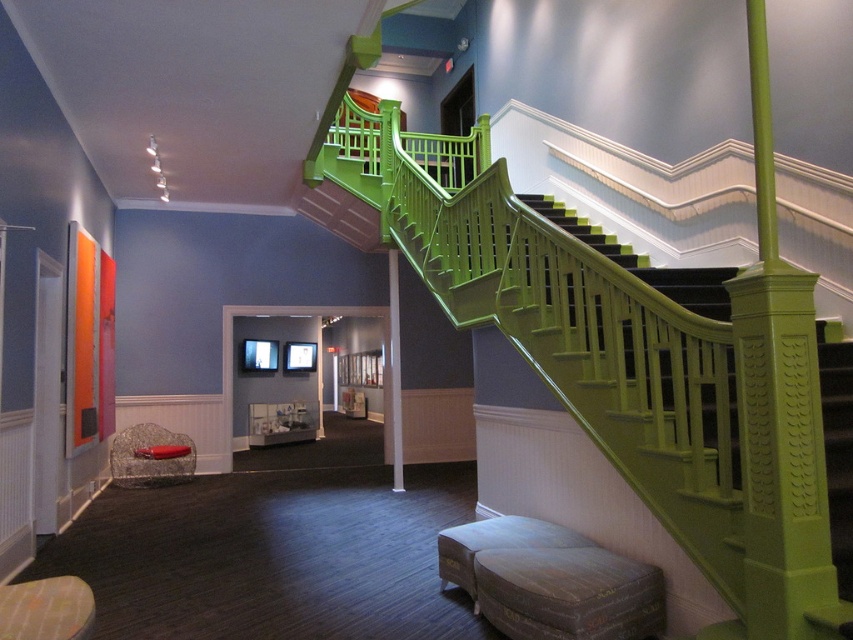
Can you confirm if distressed brown leather stool at lower center is positioned above velvet grey ottoman at lower center?

No.

Does point (515, 605) come behind point (454, 541)?

No, (515, 605) is closer to viewer.

This screenshot has height=640, width=853. In order to click on distressed brown leather stool at lower center in this screenshot , I will do `click(567, 593)`.